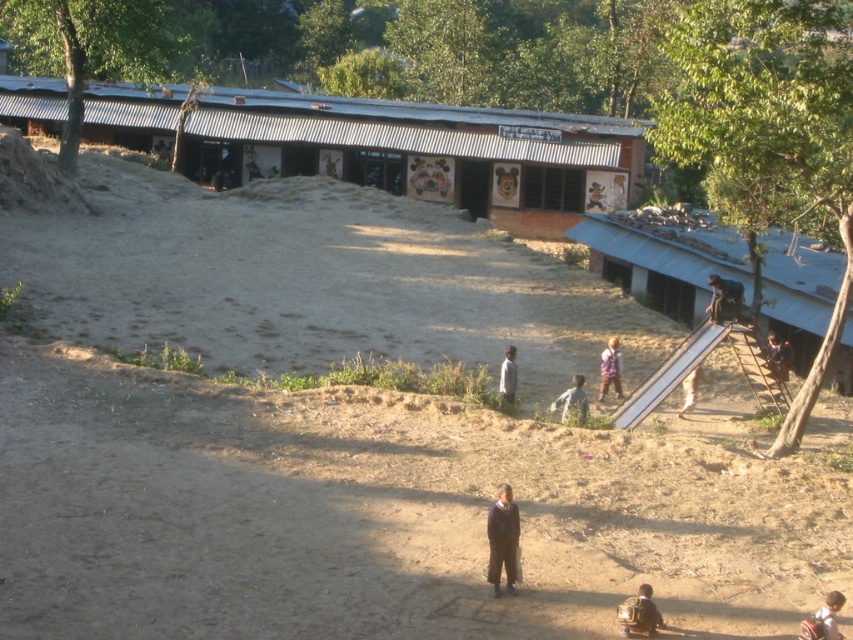
Question: Which of these objects is positioned farthest from the brown sandy dirt track at lower center?

Choices:
 (A) gray matte shirt at center
 (B) brown leather backpack at lower center
 (C) blue corrugated metal hut at right

Answer: (C)

Question: Which of the following is the closest to the observer?

Choices:
 (A) (700, 241)
 (B) (572, 388)
 (C) (496, 499)

Answer: (C)

Question: Is gray matte shirt at center behind white fabric pants at right?

Choices:
 (A) yes
 (B) no

Answer: (B)

Question: Does brown leather backpack at lower center have a larger size compared to dark blue jeans at lower right?

Choices:
 (A) yes
 (B) no

Answer: (B)

Question: Which of these objects is positioned farthest from the brown leather backpack at lower center?

Choices:
 (A) dark blue shirt at upper right
 (B) white matte shirt at center
 (C) brown sandy dirt track at lower center

Answer: (A)

Question: Is corrugated metal building at upper center bigger than dark blue uniform at center?

Choices:
 (A) no
 (B) yes

Answer: (B)